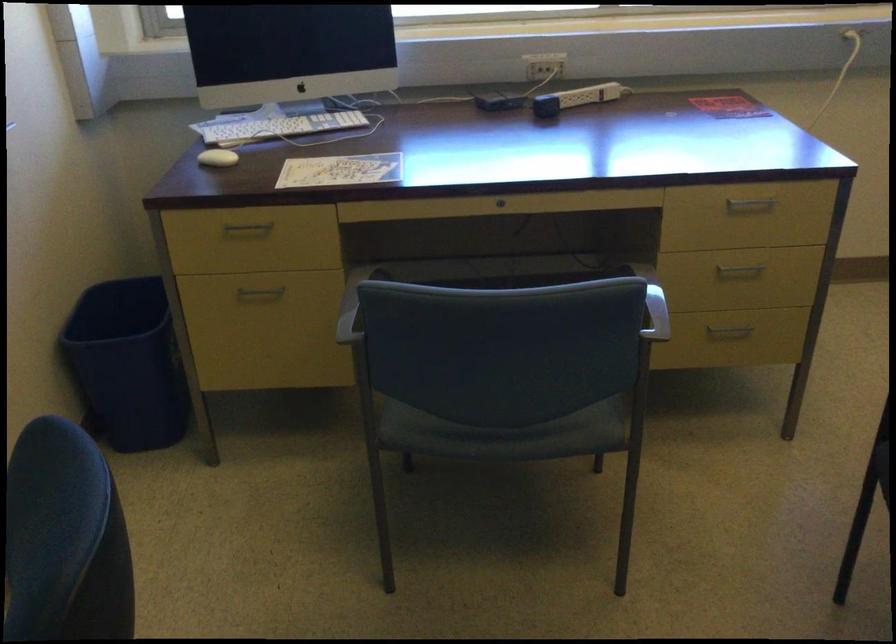
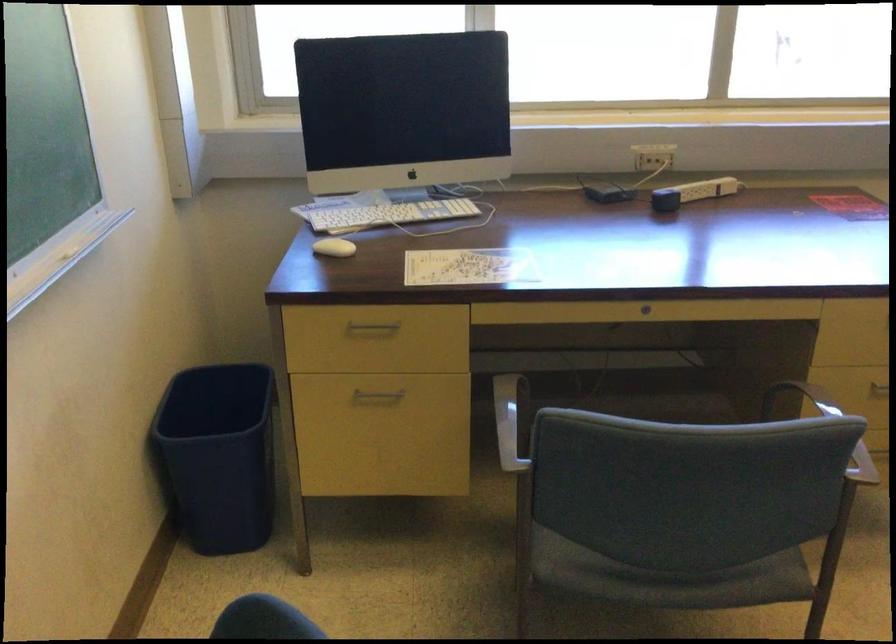
Locate, in the second image, the point that corresponds to point 218,158 in the first image.

(333, 247)